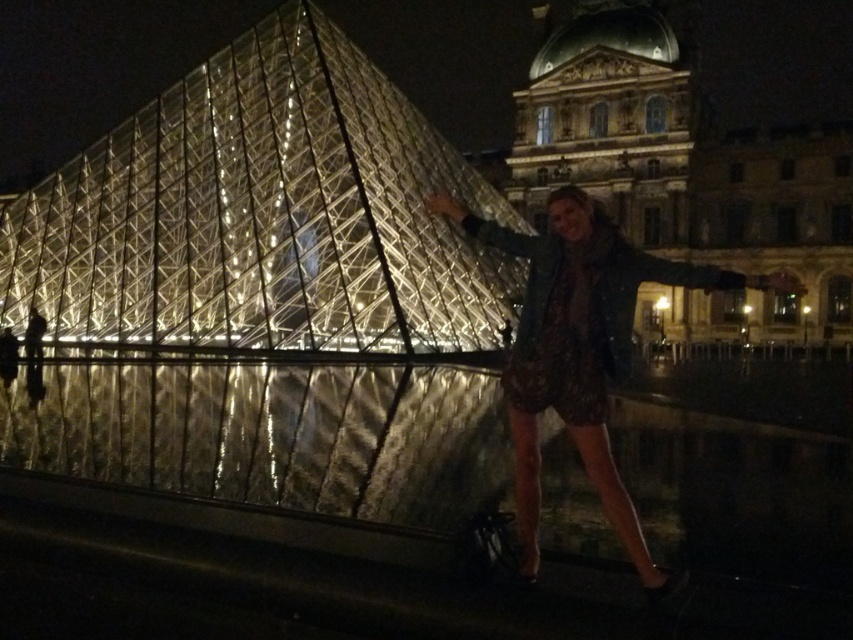
Question: Is patterned fabric dress at center smaller than dotted fabric dress at center?

Choices:
 (A) yes
 (B) no

Answer: (B)

Question: Which object is farther from the camera taking this photo?

Choices:
 (A) patterned fabric dress at center
 (B) dotted fabric dress at center
 (C) transparent glass pyramid at center

Answer: (C)

Question: Which of these objects is positioned farthest from the dotted fabric dress at center?

Choices:
 (A) transparent glass pyramid at center
 (B) patterned fabric dress at center

Answer: (A)

Question: Which point is farther from the camera taking this photo?

Choices:
 (A) (390, 301)
 (B) (534, 285)

Answer: (A)

Question: Does transparent glass pyramid at center come in front of patterned fabric dress at center?

Choices:
 (A) yes
 (B) no

Answer: (B)

Question: In this image, where is patterned fabric dress at center located relative to dotted fabric dress at center?

Choices:
 (A) below
 (B) above

Answer: (A)